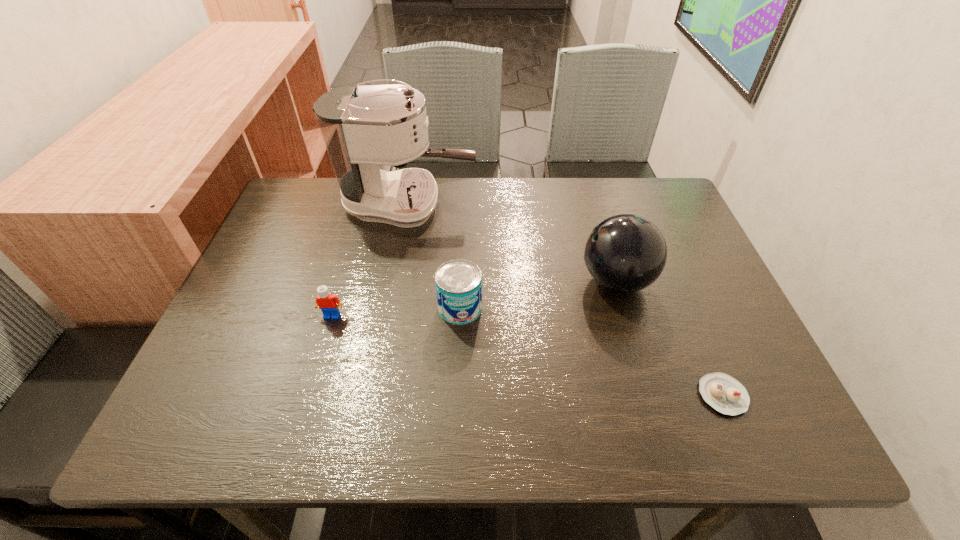
Where is `coffee maker`? The image size is (960, 540). coffee maker is located at coordinates (364, 128).

You are a GUI agent. You are given a task and a screenshot of the screen. Output one action in this format:
    pyautogui.click(x=<x>, y=<y>)
    Task: Click on the tallest object
    
    Given the screenshot: What is the action you would take?
    pyautogui.click(x=364, y=128)

Find the location of `bowling ball`. bowling ball is located at coordinates (625, 253).

I want to click on the fourth object from left to right, so click(625, 253).

Identify the location of can. The height and width of the screenshot is (540, 960). (458, 282).

The image size is (960, 540). What are the coordinates of `Lego` in the screenshot? It's located at (325, 301).

I want to click on the rightmost object, so click(x=725, y=394).

This screenshot has width=960, height=540. I want to click on the shortest object, so click(x=725, y=394).

Where is `free space located 0.130m on the front-facing side of the tallest object`? The height and width of the screenshot is (540, 960). free space located 0.130m on the front-facing side of the tallest object is located at coordinates (522, 205).

I want to click on vacant region located 0.050m on the side of the fourth shortest object with the finger holes, so click(558, 281).